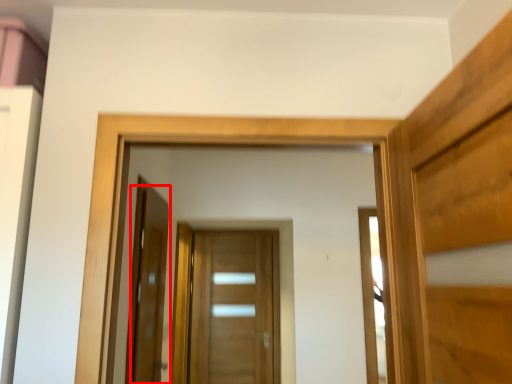
Question: From the image's perspective, what is the correct spatial relationship of door (annotated by the red box) in relation to door?

Choices:
 (A) above
 (B) below

Answer: (A)